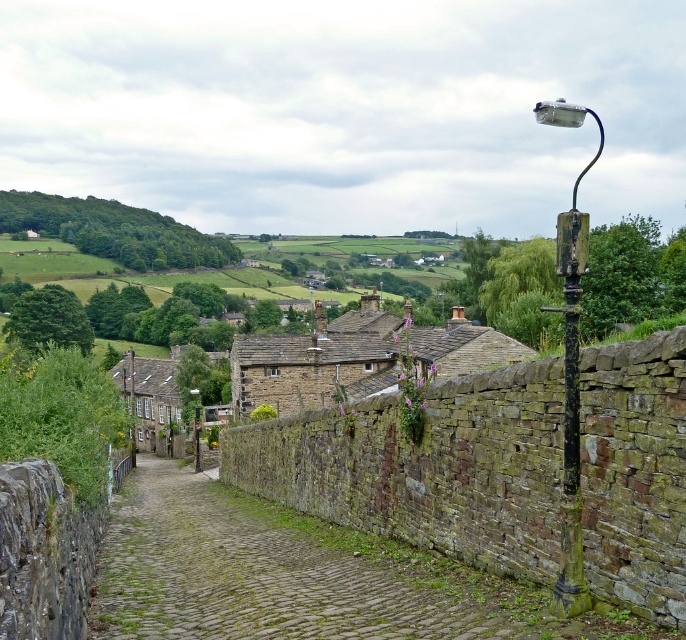
Question: Which point is closer to the camera?

Choices:
 (A) green mossy cobblestone path at center
 (B) brown stone houses at center

Answer: (A)

Question: Is green mossy cobblestone path at center to the left of rusty metal streetlamp at right from the viewer's perspective?

Choices:
 (A) no
 (B) yes

Answer: (B)

Question: Which object appears closest to the camera in this image?

Choices:
 (A) green mossy cobblestone path at center
 (B) rusty metal streetlamp at right
 (C) brown stone houses at center

Answer: (A)

Question: Does green mossy cobblestone path at center have a lesser width compared to rusty metal streetlamp at right?

Choices:
 (A) yes
 (B) no

Answer: (A)

Question: Which point appears closest to the camera in this image?

Choices:
 (A) (368, 364)
 (B) (272, 624)

Answer: (B)

Question: Does brown stone houses at center have a lesser width compared to rusty metal streetlamp at right?

Choices:
 (A) yes
 (B) no

Answer: (A)